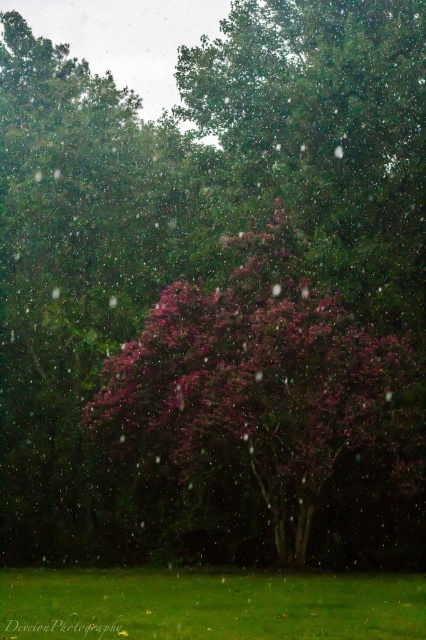
Question: Is the position of pink matte flower at center more distant than that of green grass at lower center?

Choices:
 (A) yes
 (B) no

Answer: (A)

Question: Among these points, which one is nearest to the camera?

Choices:
 (A) (362, 611)
 (B) (115, 400)

Answer: (A)

Question: Which point is farther to the camera?

Choices:
 (A) pink matte flower at center
 (B) green grass at lower center

Answer: (A)

Question: Which point is closer to the camera?

Choices:
 (A) pink matte flower at center
 (B) green grass at lower center

Answer: (B)

Question: Observing the image, what is the correct spatial positioning of pink matte flower at center in reference to green grass at lower center?

Choices:
 (A) left
 (B) right

Answer: (B)

Question: Is pink matte flower at center bigger than green grass at lower center?

Choices:
 (A) no
 (B) yes

Answer: (B)